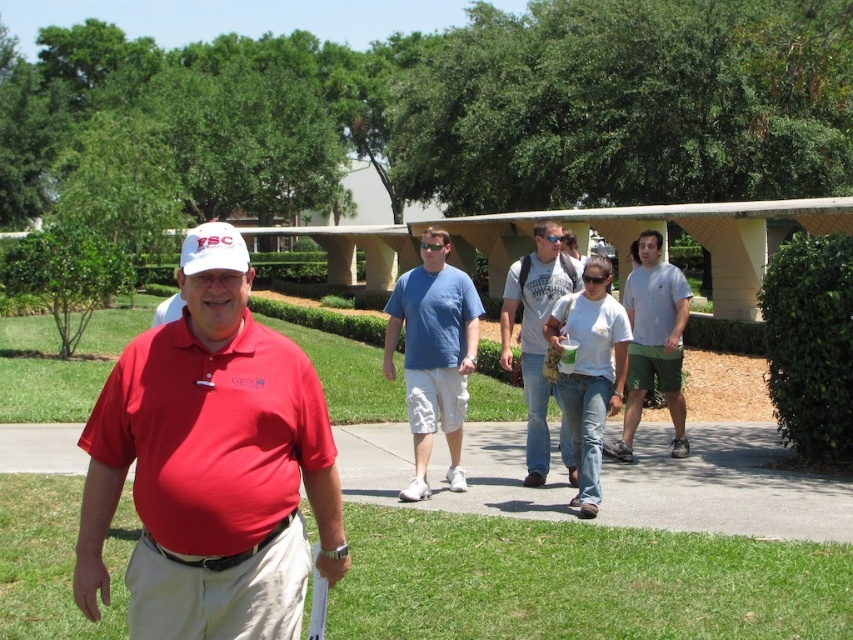
Which is in front, point (631, 384) or point (534, 273)?

Point (534, 273) is in front.

Which of these two, gray cotton t-shirt at center or light gray cotton t-shirt at center, stands taller?

With more height is gray cotton t-shirt at center.

This screenshot has height=640, width=853. I want to click on gray cotton t-shirt at center, so click(x=653, y=342).

The height and width of the screenshot is (640, 853). In order to click on white cotton shirt at center in this screenshot , I will do `click(589, 371)`.

Who is positioned more to the left, white cotton shirt at center or blue cotton polo shirt at center?

blue cotton polo shirt at center is more to the left.

Measure the distance between white cotton shirt at center and camera.

white cotton shirt at center is 21.91 feet away from camera.

Locate an element on the screen. This screenshot has width=853, height=640. white cotton shirt at center is located at coordinates (589, 371).

Does matte khaki pants at center appear on the right side of white matte baseball cap at center?

Correct, you'll find matte khaki pants at center to the right of white matte baseball cap at center.

Measure the distance between matte khaki pants at center and white matte baseball cap at center.

matte khaki pants at center and white matte baseball cap at center are 1.21 meters apart.

Measure the distance between matte khaki pants at center and camera.

They are 2.65 meters apart.

This screenshot has height=640, width=853. Find the location of `matte khaki pants at center`. matte khaki pants at center is located at coordinates [x=212, y=474].